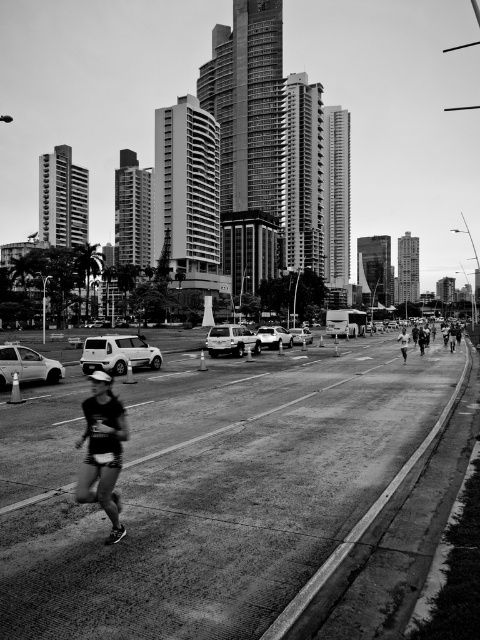
Question: Can you confirm if metallic silver van at center is bigger than metallic silver sedan at center?

Choices:
 (A) no
 (B) yes

Answer: (A)

Question: Is dark gray fabric shorts at lower left to the left of metallic silver van at center from the viewer's perspective?

Choices:
 (A) no
 (B) yes

Answer: (B)

Question: Can you confirm if matte silver suv at center is positioned above metallic silver sedan at center?

Choices:
 (A) yes
 (B) no

Answer: (B)

Question: Which object appears closest to the camera in this image?

Choices:
 (A) dark gray fabric shorts at lower left
 (B) matte silver suv at center
 (C) matte white suv at center
 (D) matte silver car at left

Answer: (A)

Question: Among these objects, which one is nearest to the camera?

Choices:
 (A) matte white suv at center
 (B) dark gray fabric shorts at lower left
 (C) matte silver suv at center

Answer: (B)

Question: Which of the following is the farthest from the observer?

Choices:
 (A) metallic silver van at center
 (B) matte silver car at left
 (C) dark gray fabric shorts at lower left

Answer: (A)